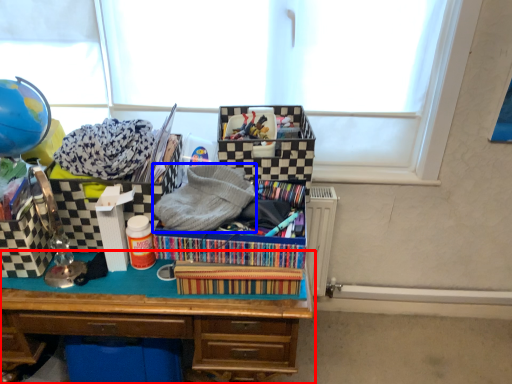
Question: Which object appears closest to the camera in this image, desk (highlighted by a red box) or clothing (highlighted by a blue box)?

Choices:
 (A) desk
 (B) clothing

Answer: (B)